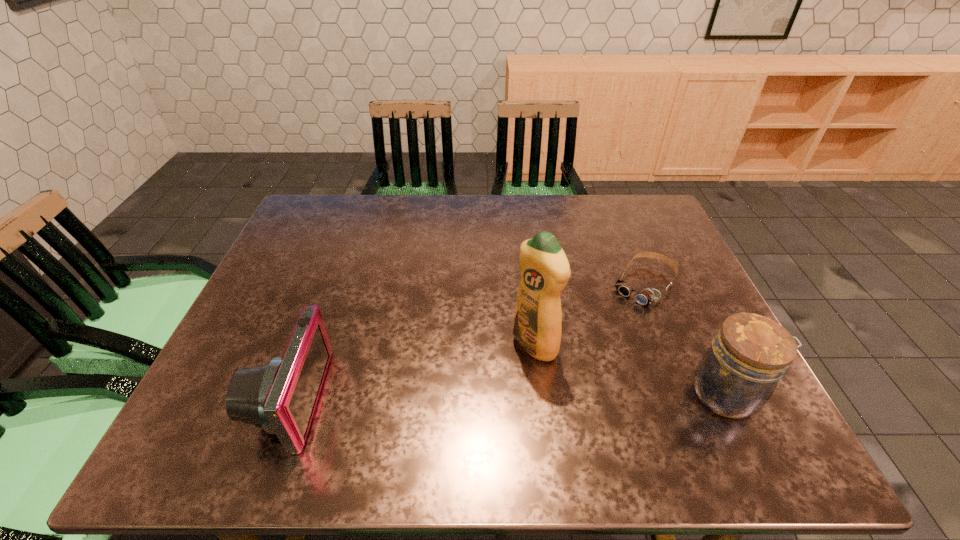
The width and height of the screenshot is (960, 540). What are the coordinates of `free space located 0.290m on the front-facing side of the farthest object` in the screenshot? It's located at (569, 376).

You are a GUI agent. You are given a task and a screenshot of the screen. Output one action in this format:
    pyautogui.click(x=<x>, y=<y>)
    Task: Click on the vacant position located on the front-facing side of the farthest object
    
    Given the screenshot: What is the action you would take?
    618,316

Find the location of a particular element. free point located on the label of the tallest object is located at coordinates (494, 379).

Locate an element on the screen. The width and height of the screenshot is (960, 540). vacant space located on the label of the tallest object is located at coordinates (494, 379).

What are the coordinates of `free space located on the label of the tallest object` in the screenshot? It's located at (488, 384).

Locate an element on the screen. The image size is (960, 540). camera situated at the near edge is located at coordinates click(280, 396).

Image resolution: width=960 pixels, height=540 pixels. Identify the location of jar that is positioned at the near edge. (737, 375).

Locate an element on the screen. This screenshot has width=960, height=540. object at the left edge is located at coordinates (280, 396).

You are a GUI agent. You are given a task and a screenshot of the screen. Output one action in this format:
    pyautogui.click(x=<x>, y=<y>)
    Task: Click on the jar located at the right edge
    
    Given the screenshot: What is the action you would take?
    pyautogui.click(x=737, y=375)

What are the coordinates of `goggles that is at the right edge` in the screenshot? It's located at (646, 296).